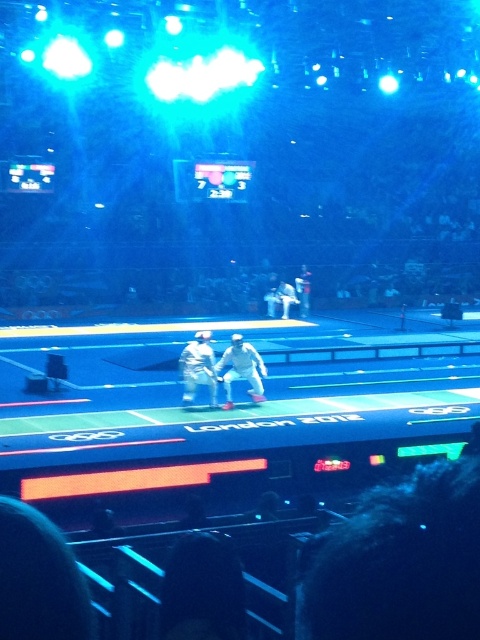
Between white fabric tennis racket at center and camouflage fabric uniform at center, which one has less height?

With less height is white fabric tennis racket at center.

Locate an element on the screen. The height and width of the screenshot is (640, 480). white fabric tennis racket at center is located at coordinates (241, 369).

Identify the location of white fabric tennis racket at center. The image size is (480, 640). (241, 369).